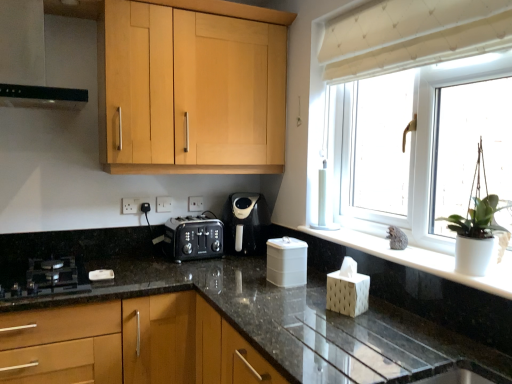
This screenshot has width=512, height=384. Find the location of `free spot below beige fabric curtain at upper right (from a real-world perspective)`. free spot below beige fabric curtain at upper right (from a real-world perspective) is located at coordinates pos(383,244).